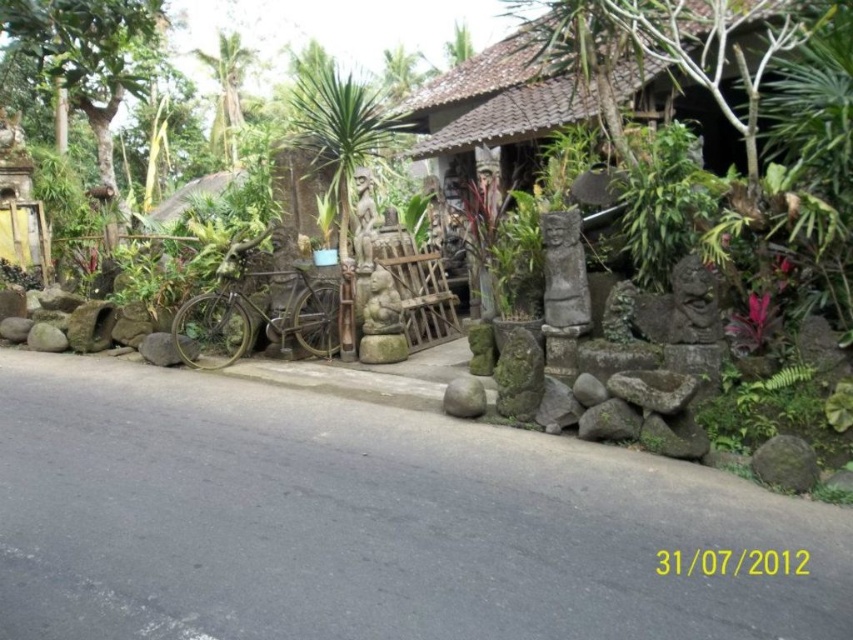
Who is positioned more to the right, brown textured hut at center or green stone at center?

brown textured hut at center

Between point (699, 13) and point (479, 401), which one is positioned in front?

Positioned in front is point (479, 401).

I want to click on brown textured hut at center, so click(604, 68).

Does rusty metal bicycle at center have a smaller size compared to green stone at center?

No.

The image size is (853, 640). Describe the element at coordinates (257, 312) in the screenshot. I see `rusty metal bicycle at center` at that location.

Describe the element at coordinates (257, 312) in the screenshot. This screenshot has height=640, width=853. I see `rusty metal bicycle at center` at that location.

This screenshot has height=640, width=853. Identify the location of rusty metal bicycle at center. (257, 312).

Between rusty metal bicycle at center and rustic stone at center, which one is positioned higher?

rusty metal bicycle at center

Is rusty metal bicycle at center below rustic stone at center?

Actually, rusty metal bicycle at center is above rustic stone at center.

Locate an element on the screen. The image size is (853, 640). rusty metal bicycle at center is located at coordinates (257, 312).